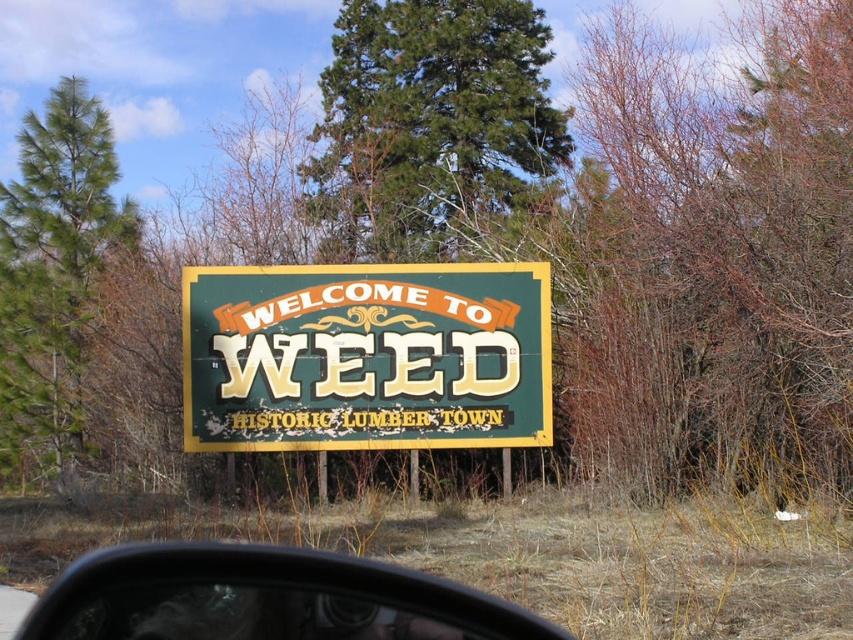
You are driving and see the sign in the image. What is the color of the sign at the point with coordinates (366, 356)?

The point at coordinates (366, 356) corresponds to the green vintage sign at center, so the color is green.

You are driving and notice the green pine tree at center and the transparent plastic side mirror at lower center in your view. Which object appears wider from your perspective?

The green pine tree at center appears wider than the transparent plastic side mirror at lower center because its width surpasses the mirror.